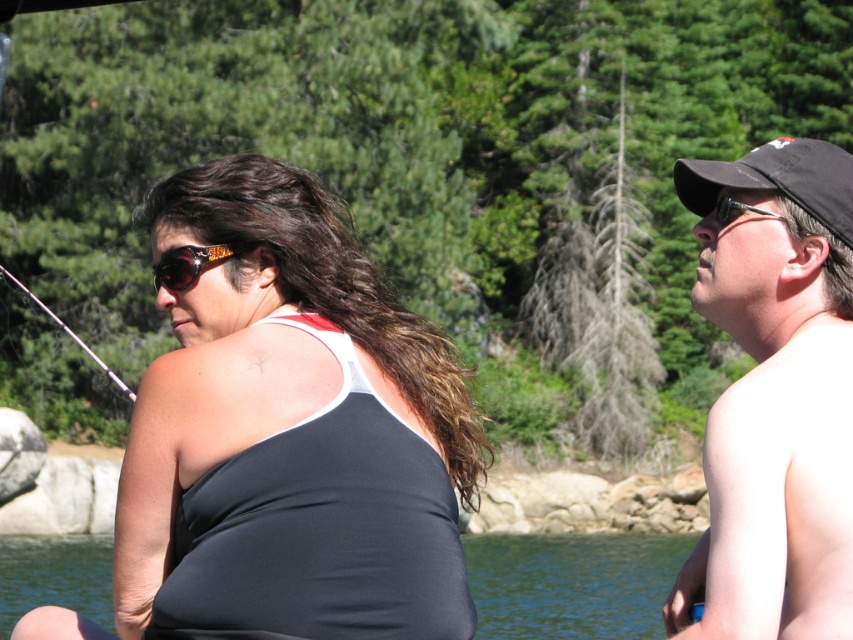
You are standing in front of the image and want to locate the black cap at right. Where is it positioned in terms of horizontal and vertical coordinates on a scale from 0 to 1?

The black cap at right is located at the 2D coordinates of point 0.616 horizontally and 0.910 vertically on a scale from 0 to 1.